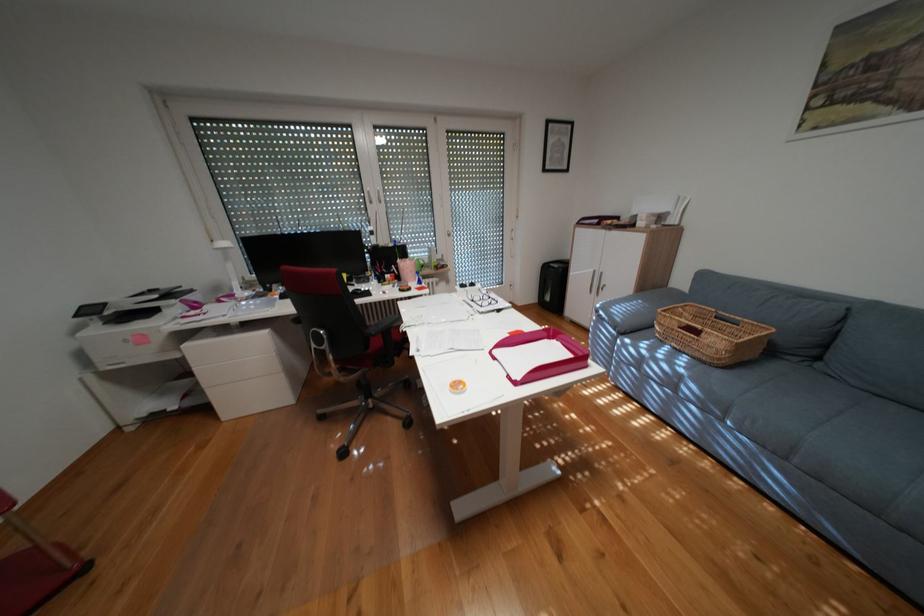
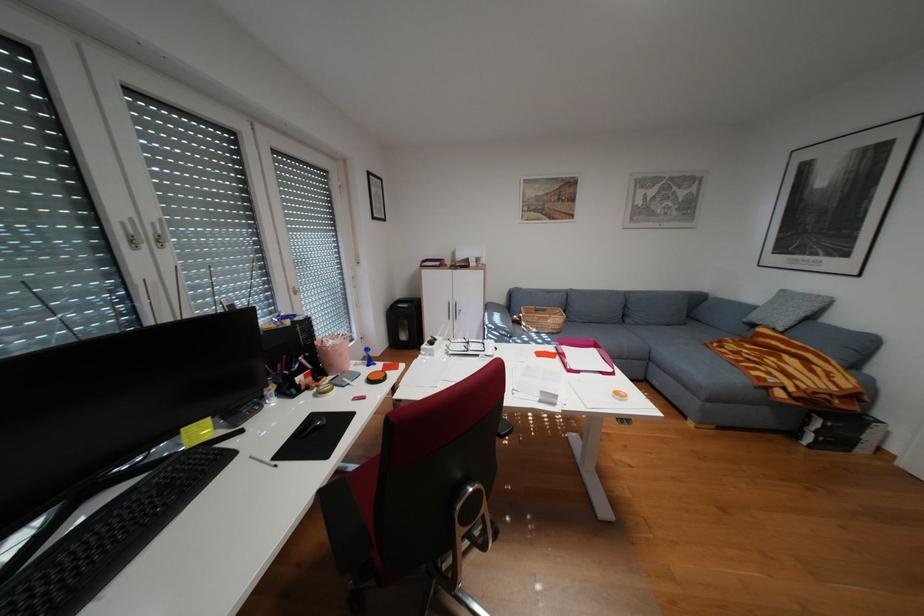
Locate, in the second image, the point that corresponds to (506,358) in the first image.

(590, 371)